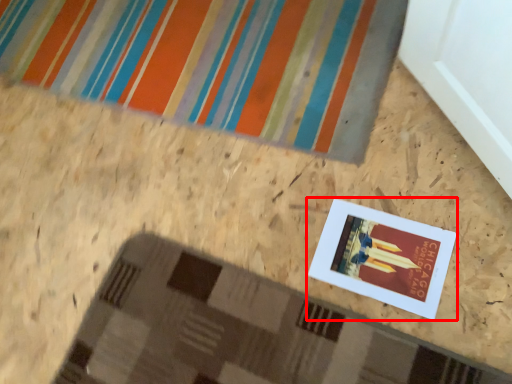
Question: Considering the relative positions of picture frame (annotated by the red box) and bath mat in the image provided, where is picture frame (annotated by the red box) located with respect to the staircase?

Choices:
 (A) right
 (B) left

Answer: (A)